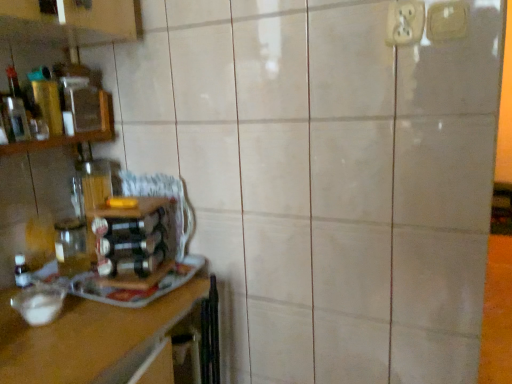
Measure the distance between point (x=128, y=314) and camera.

Point (x=128, y=314) and camera are 3.30 feet apart.

What do you see at coordinates (73, 135) in the screenshot?
I see `wooden shelf at left` at bounding box center [73, 135].

Find the location of a particular element. The image size is (512, 384). white plastic electric outlet at upper right, which is counted as the 1th electric outlet, starting from the left is located at coordinates (405, 22).

Considering the sizes of objects wooden shelf at left and translucent glass bottle at left in the image provided, who is shorter, wooden shelf at left or translucent glass bottle at left?

wooden shelf at left.

Is wooden shelf at left further to the viewer compared to translucent glass bottle at left?

That is False.

Is wooden shelf at left turned away from translucent glass bottle at left?

wooden shelf at left does not have its back to translucent glass bottle at left.

Would you say white plastic electric outlet at upper right, which is counted as the 1th electric outlet, starting from the left, is a long distance from white plastic electric outlet at upper right, the 1th electric outlet from the right?

No, white plastic electric outlet at upper right, which is counted as the 1th electric outlet, starting from the left, is in close proximity to white plastic electric outlet at upper right, the 1th electric outlet from the right.

Is white plastic electric outlet at upper right, which is counted as the 1th electric outlet, starting from the left, facing towards white plastic electric outlet at upper right, the 1th electric outlet from the right?

No, white plastic electric outlet at upper right, which is counted as the 1th electric outlet, starting from the left, does not turn towards white plastic electric outlet at upper right, the 1th electric outlet from the right.

From the image's perspective, is white plastic electric outlet at upper right, positioned as the second electric outlet in right-to-left order, located above or below white plastic electric outlet at upper right, the 2th electric outlet from the left?

Based on their image positions, white plastic electric outlet at upper right, positioned as the second electric outlet in right-to-left order, is located above white plastic electric outlet at upper right, the 2th electric outlet from the left.

Is white plastic electric outlet at upper right, the 2th electric outlet from the left, smaller than white plastic electric outlet at upper right, which is counted as the 1th electric outlet, starting from the left?

Yes.

Can you confirm if white plastic electric outlet at upper right, the 2th electric outlet from the left, is shorter than white plastic electric outlet at upper right, positioned as the second electric outlet in right-to-left order?

Indeed, white plastic electric outlet at upper right, the 2th electric outlet from the left, has a lesser height compared to white plastic electric outlet at upper right, positioned as the second electric outlet in right-to-left order.

Is white plastic electric outlet at upper right, the 2th electric outlet from the left, completely or partially outside of white plastic electric outlet at upper right, which is counted as the 1th electric outlet, starting from the left?

white plastic electric outlet at upper right, the 2th electric outlet from the left, lies outside white plastic electric outlet at upper right, which is counted as the 1th electric outlet, starting from the left,'s area.

Is white plastic electric outlet at upper right, the 2th electric outlet from the left, at the left side of white plastic electric outlet at upper right, which is counted as the 1th electric outlet, starting from the left?

Incorrect, white plastic electric outlet at upper right, the 2th electric outlet from the left, is not on the left side of white plastic electric outlet at upper right, which is counted as the 1th electric outlet, starting from the left.

Is white plastic electric outlet at upper right, the 2th electric outlet from the left, oriented away from wooden at left?

No.

Which is more distant, [431,5] or [12,359]?

The point [431,5] is behind.

Which of these two, white plastic electric outlet at upper right, the 2th electric outlet from the left, or wooden at left, is smaller?

white plastic electric outlet at upper right, the 2th electric outlet from the left.

From the image's perspective, is white plastic electric outlet at upper right, the 2th electric outlet from the left, located above wooden shelf at left?

Yes, from the image's perspective, white plastic electric outlet at upper right, the 2th electric outlet from the left, is above wooden shelf at left.

From the image's perspective, starting from the wooden shelf at left, which electric outlet is the 1st one above? Please provide its 2D coordinates.

[(447, 21)]

Considering the sizes of objects white plastic electric outlet at upper right, the 1th electric outlet from the right, and wooden shelf at left in the image provided, who is shorter, white plastic electric outlet at upper right, the 1th electric outlet from the right, or wooden shelf at left?

With less height is white plastic electric outlet at upper right, the 1th electric outlet from the right.

Consider the image. Is white plastic electric outlet at upper right, the 1th electric outlet from the right, wider or thinner than wooden shelf at left?

Considering their sizes, white plastic electric outlet at upper right, the 1th electric outlet from the right, looks slimmer than wooden shelf at left.

Considering the relative sizes of white plastic electric outlet at upper right, which is counted as the 1th electric outlet, starting from the left, and wooden shelf at left in the image provided, is white plastic electric outlet at upper right, which is counted as the 1th electric outlet, starting from the left, smaller than wooden shelf at left?

Correct, white plastic electric outlet at upper right, which is counted as the 1th electric outlet, starting from the left, occupies less space than wooden shelf at left.

From the image's perspective, which is below, white plastic electric outlet at upper right, positioned as the second electric outlet in right-to-left order, or wooden shelf at left?

From the image's view, wooden shelf at left is below.

From a real-world perspective, is white plastic electric outlet at upper right, positioned as the second electric outlet in right-to-left order, over wooden shelf at left?

Yes, from a real-world perspective, white plastic electric outlet at upper right, positioned as the second electric outlet in right-to-left order, is over wooden shelf at left

Who is more distant, white plastic electric outlet at upper right, positioned as the second electric outlet in right-to-left order, or wooden shelf at left?

wooden shelf at left is further from the camera.

Can you confirm if translucent glass bottle at left is taller than wooden shelf at left?

Correct, translucent glass bottle at left is much taller as wooden shelf at left.

Considering the positions of objects translucent glass bottle at left and wooden shelf at left in the image provided, who is in front, translucent glass bottle at left or wooden shelf at left?

wooden shelf at left.

Image resolution: width=512 pixels, height=384 pixels. Identify the location of bottle on the right of wooden shelf at left. tap(130, 244).

Where is `shelf in front of the translucent glass bottle at left`? The height and width of the screenshot is (384, 512). shelf in front of the translucent glass bottle at left is located at coordinates (73, 135).

Identify the location of electric outlet that is on the right side of white plastic electric outlet at upper right, positioned as the second electric outlet in right-to-left order. (447, 21).

Looking at the image, which one is located further to wooden at left, translucent glass bottle at left or white plastic electric outlet at upper right, the 1th electric outlet from the right?

white plastic electric outlet at upper right, the 1th electric outlet from the right, is positioned further to the anchor wooden at left.

Looking at the image, which one is located closer to wooden shelf at left, white plastic electric outlet at upper right, positioned as the second electric outlet in right-to-left order, or white plastic electric outlet at upper right, the 2th electric outlet from the left?

Among the two, white plastic electric outlet at upper right, positioned as the second electric outlet in right-to-left order, is located nearer to wooden shelf at left.

Considering their positions, is white plastic electric outlet at upper right, the 1th electric outlet from the right, positioned closer to wooden at left than translucent glass bottle at left?

translucent glass bottle at left is closer to wooden at left.

Based on the photo, when comparing their distances from wooden shelf at left, does white plastic electric outlet at upper right, the 2th electric outlet from the left, or wooden at left seem closer?

wooden at left.

Based on their spatial positions, is translucent glass bottle at left or white plastic electric outlet at upper right, the 1th electric outlet from the right, further from wooden shelf at left?

Among the two, white plastic electric outlet at upper right, the 1th electric outlet from the right, is located further to wooden shelf at left.

Based on the photo, looking at the image, which one is located closer to translucent glass bottle at left, wooden at left or white plastic electric outlet at upper right, positioned as the second electric outlet in right-to-left order?

wooden at left.

Based on their spatial positions, is wooden shelf at left or wooden at left closer to translucent glass bottle at left?

wooden at left lies closer to translucent glass bottle at left than the other object.

When comparing their distances from white plastic electric outlet at upper right, the 2th electric outlet from the left, does white plastic electric outlet at upper right, positioned as the second electric outlet in right-to-left order, or wooden shelf at left seem further?

wooden shelf at left.

This screenshot has height=384, width=512. Find the location of `bottle located between wooden shelf at left and white plastic electric outlet at upper right, which is counted as the 1th electric outlet, starting from the left, in the left-right direction`. bottle located between wooden shelf at left and white plastic electric outlet at upper right, which is counted as the 1th electric outlet, starting from the left, in the left-right direction is located at coordinates (130, 244).

Where is `bottle between white plastic electric outlet at upper right, positioned as the second electric outlet in right-to-left order, and wooden at left vertically`? bottle between white plastic electric outlet at upper right, positioned as the second electric outlet in right-to-left order, and wooden at left vertically is located at coordinates (130, 244).

Locate an element on the screen. The width and height of the screenshot is (512, 384). bottle between wooden shelf at left and white plastic electric outlet at upper right, the 1th electric outlet from the right, from left to right is located at coordinates (130, 244).

I want to click on electric outlet between wooden shelf at left and white plastic electric outlet at upper right, the 2th electric outlet from the left, in the horizontal direction, so click(405, 22).